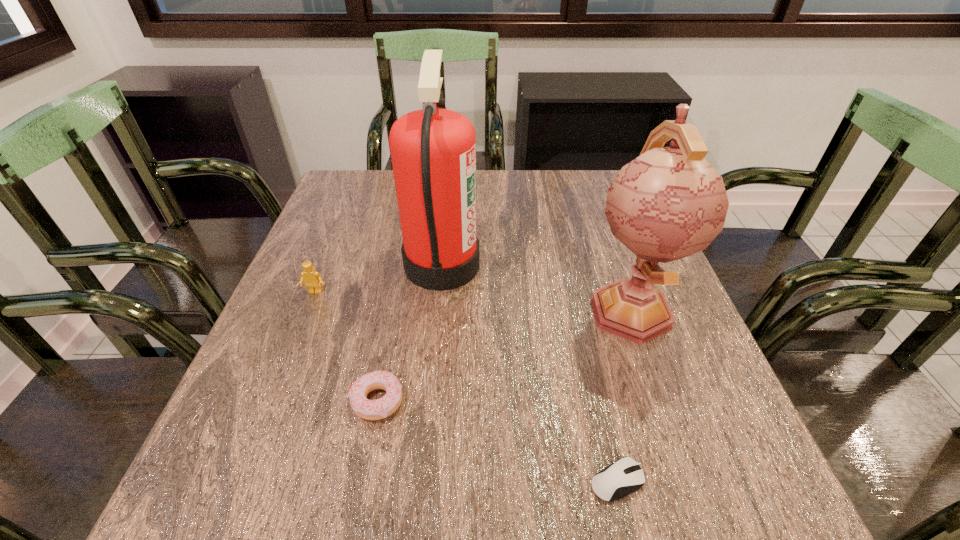
Identify the location of free location at the far right corner of the desktop. This screenshot has width=960, height=540. (598, 213).

Where is `free spot between the globe and the mouse`? This screenshot has height=540, width=960. free spot between the globe and the mouse is located at coordinates (623, 395).

This screenshot has width=960, height=540. What are the coordinates of `empty space between the fourth farthest object and the leftmost object` in the screenshot? It's located at (347, 346).

At what (x,y) coordinates should I click in order to perform the action: click on vacant space that's between the mouse and the globe. Please return your answer as a coordinate pair (x, y). This screenshot has width=960, height=540. Looking at the image, I should click on (623, 395).

Where is `free space between the leftmost object and the fourth farthest object`? The height and width of the screenshot is (540, 960). free space between the leftmost object and the fourth farthest object is located at coordinates (347, 346).

Where is `free space between the second nearest object and the third shortest object`? This screenshot has width=960, height=540. free space between the second nearest object and the third shortest object is located at coordinates (347, 346).

Where is `vacant space that's between the fire extinguisher and the shortest object`? vacant space that's between the fire extinguisher and the shortest object is located at coordinates tap(529, 373).

Where is `vacant space that is in between the mouse and the globe`? vacant space that is in between the mouse and the globe is located at coordinates (623, 395).

The width and height of the screenshot is (960, 540). I want to click on free space between the second shortest object and the globe, so click(x=503, y=355).

Identify the location of vacant area that lies between the leftmost object and the shortest object. The image size is (960, 540). (466, 387).